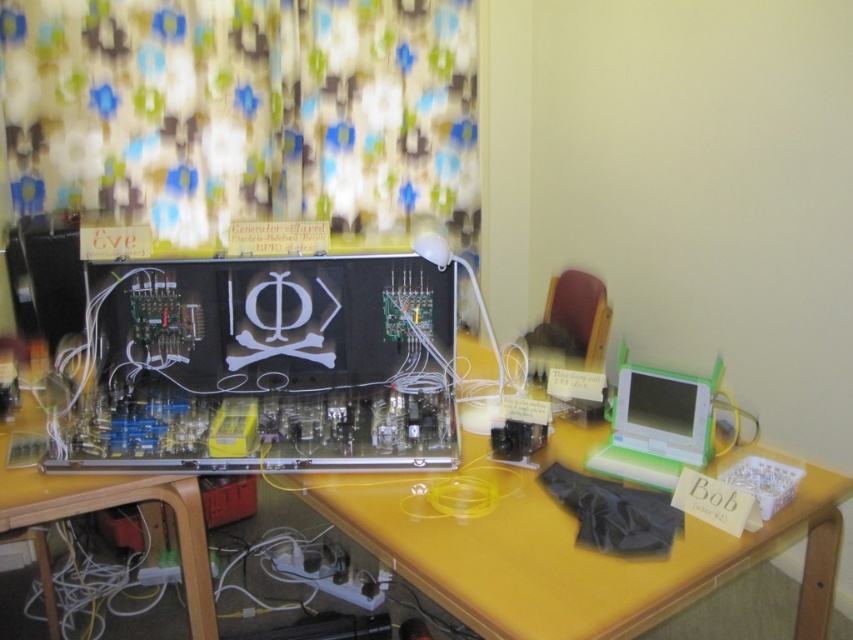
Is point (163, 336) closer to viewer compared to point (0, 477)?

No, (163, 336) is further to viewer.

Between point (254, 417) and point (640, 608), which one is positioned behind?

The point (254, 417) is more distant.

Where is `matte black circuit board at center`? matte black circuit board at center is located at coordinates (264, 365).

Which is more to the right, matte black circuit board at center or white plastic laptop at right?

From the viewer's perspective, white plastic laptop at right appears more on the right side.

Consider the image. Can you confirm if matte black circuit board at center is shorter than white plastic laptop at right?

No, matte black circuit board at center is not shorter than white plastic laptop at right.

Is point (279, 260) positioned before point (637, 406)?

That is False.

Identify the location of matte black circuit board at center. This screenshot has height=640, width=853. (264, 365).

Does floral fabric curtain at upper left have a smaller size compared to matte black circuit board at center?

No.

Is floral fabric curtain at upper left shorter than matte black circuit board at center?

Incorrect, floral fabric curtain at upper left's height does not fall short of matte black circuit board at center's.

Describe the element at coordinates (244, 115) in the screenshot. I see `floral fabric curtain at upper left` at that location.

Find the location of a particular element. The image size is (853, 640). floral fabric curtain at upper left is located at coordinates (244, 115).